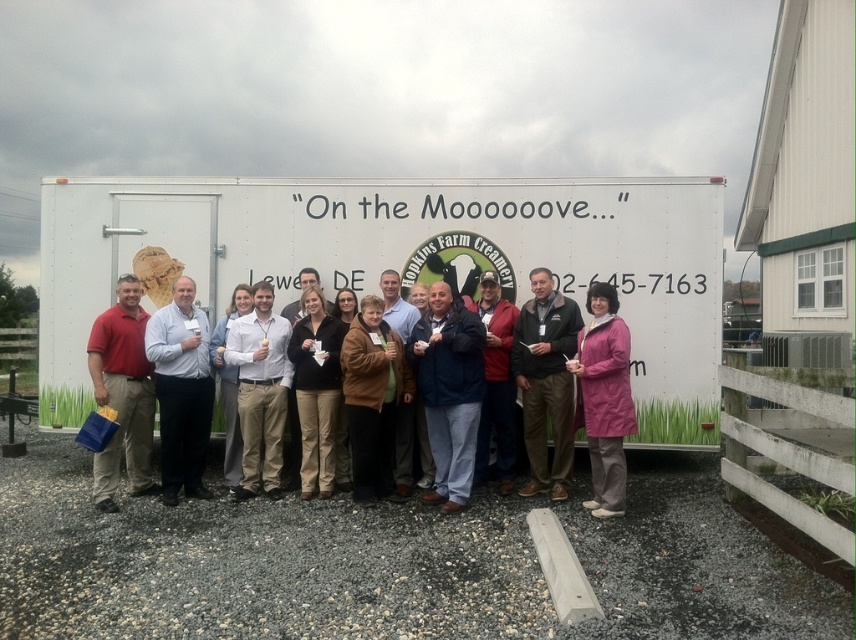
Can you confirm if black matte jacket at center is shorter than light brown leather jacket at center?

Correct, black matte jacket at center is not as tall as light brown leather jacket at center.

Who is more forward, (318,340) or (230,472)?

Point (318,340) is more forward.

Identify the location of black matte jacket at center. This screenshot has width=856, height=640. (316, 392).

Find the location of a particular element. This screenshot has height=640, width=856. brown fabric jacket at center is located at coordinates click(x=545, y=381).

Is point (560, 349) in front of point (598, 282)?

Yes, point (560, 349) is in front of point (598, 282).

Find the location of `brown fabric jacket at center`. brown fabric jacket at center is located at coordinates (545, 381).

Does black matte jacket at center have a greater height compared to blue denim jacket at center?

No, black matte jacket at center is not taller than blue denim jacket at center.

This screenshot has width=856, height=640. Describe the element at coordinates (316, 392) in the screenshot. I see `black matte jacket at center` at that location.

Is point (339, 339) behind point (485, 452)?

That is False.

I want to click on black matte jacket at center, so click(316, 392).